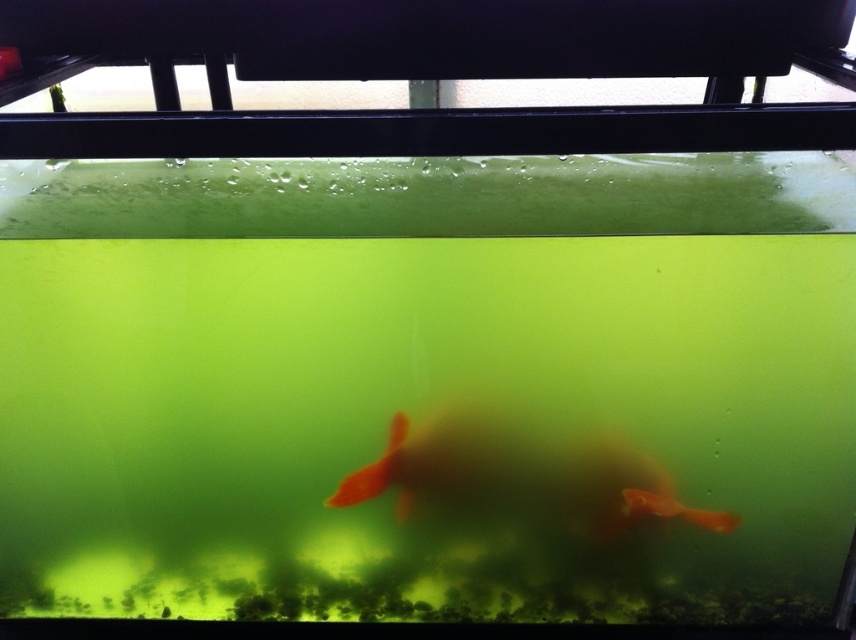
You are an aquarium maintenance worker. You need to determine which fish is taller between the translucent orange fish at center and the orange matte goldfish at center. Which one is taller?

The translucent orange fish at center has a greater height compared to the orange matte goldfish at center, so the translucent orange fish at center is taller.

You are an aquarium maintenance robot tasked with cleaning the fish tank. You need to locate the translucent orange fish at center to avoid disturbing it. What are the coordinates of the fish in the tank?

The coordinates of the translucent orange fish at center are at point (x=514, y=477).

You are standing in front of a fish tank and want to touch the point at coordinates point (x=628, y=460). If your hand is 0.5 meters long, can you reach it?

The point point (x=628, y=460) is 1.13 meters away from you. Since your hand is only 0.5 meters long, you cannot reach the point point (x=628, y=460).